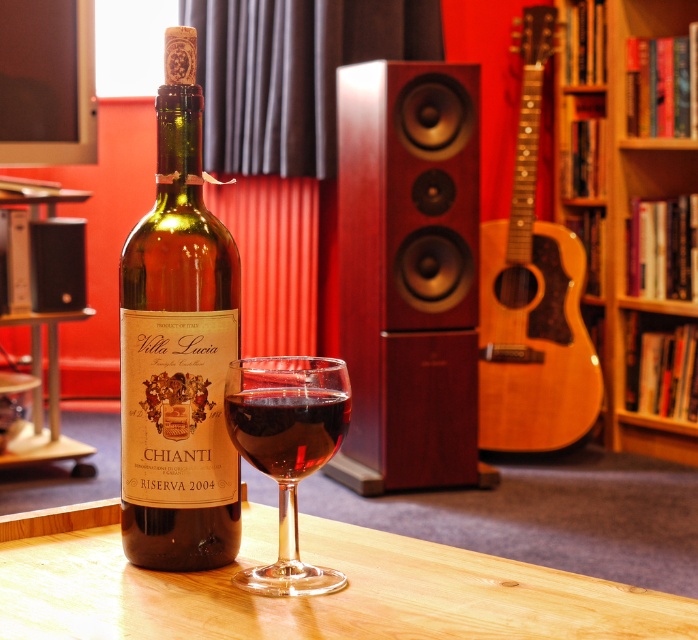
Question: Does green glass bottle at center appear under transparent glass wine glass at center?

Choices:
 (A) no
 (B) yes

Answer: (A)

Question: Can you confirm if light brown wooden guitar at right is positioned to the right of translucent glass at center?

Choices:
 (A) no
 (B) yes

Answer: (B)

Question: Can you confirm if green glass bottle at center is thinner than matte black speaker at left?

Choices:
 (A) yes
 (B) no

Answer: (A)

Question: Which point is closer to the camera taking this photo?

Choices:
 (A) (567, 257)
 (B) (288, 481)

Answer: (B)

Question: Which point appears farthest from the camera in this image?

Choices:
 (A) (544, 236)
 (B) (625, 36)

Answer: (A)

Question: Which object appears farthest from the camera in this image?

Choices:
 (A) light brown wooden guitar at right
 (B) wooden bookshelf at upper right
 (C) green glass bottle at center

Answer: (B)